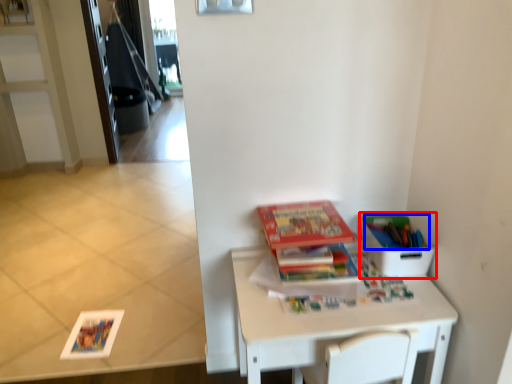
Question: Which of the following is the farthest to the observer, cardboard box (highlighted by a red box) or book (highlighted by a blue box)?

Choices:
 (A) cardboard box
 (B) book

Answer: (B)